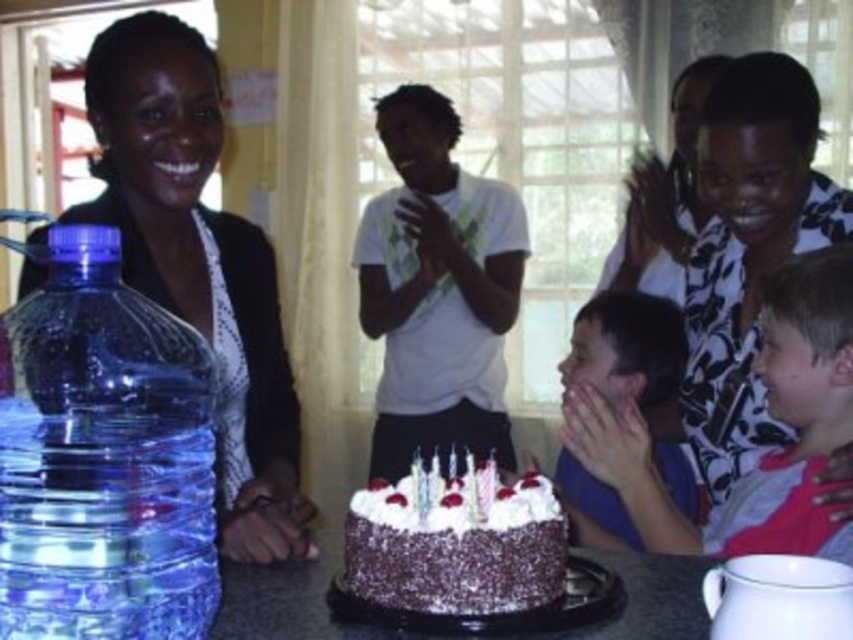
Question: Does transparent plastic bottle at left lie in front of smooth skin child at lower right?

Choices:
 (A) no
 (B) yes

Answer: (B)

Question: Which of the following is the farthest from the observer?

Choices:
 (A) smooth skin child at lower right
 (B) transparent plastic water bottle at left

Answer: (A)

Question: Which of the following is the closest to the observer?

Choices:
 (A) transparent plastic bottle at left
 (B) transparent plastic water bottle at left

Answer: (A)

Question: Does pink fabric shirt at right have a smaller size compared to smooth skin child at lower right?

Choices:
 (A) yes
 (B) no

Answer: (A)

Question: Does transparent plastic bottle at left appear on the right side of transparent plastic water bottle at left?

Choices:
 (A) yes
 (B) no

Answer: (A)

Question: Which object is closer to the camera taking this photo?

Choices:
 (A) pink fabric shirt at right
 (B) transparent plastic water bottle at left

Answer: (B)